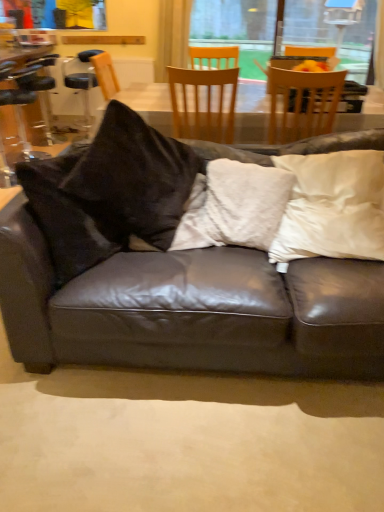
This screenshot has height=512, width=384. What do you see at coordinates (20, 115) in the screenshot?
I see `black leather bar stool at left, which is the 1th chair in left-to-right order` at bounding box center [20, 115].

What do you see at coordinates (234, 206) in the screenshot?
I see `white fuzzy pillow at center, which is the first pillow in left-to-right order` at bounding box center [234, 206].

Where is `matte black leather couch at center`? The width and height of the screenshot is (384, 512). matte black leather couch at center is located at coordinates (187, 307).

Based on the photo, what is the approximate width of white satin pillow at upper right, the 1th pillow in the right-to-left sequence?

The width of white satin pillow at upper right, the 1th pillow in the right-to-left sequence, is 15.48 inches.

This screenshot has width=384, height=512. Describe the element at coordinates (332, 207) in the screenshot. I see `white satin pillow at upper right, the 1th pillow in the right-to-left sequence` at that location.

What is the approximate height of clear plastic bar stool at left?

The height of clear plastic bar stool at left is 34.01 inches.

Consider the image. In order to face clear plastic bar stool at left, should I rotate leftwards or rightwards?

A 19.715 degree turn to the left will do.

You are a GUI agent. You are given a task and a screenshot of the screen. Output one action in this format:
    pyautogui.click(x=<x>, y=<y>)
    Task: Click on the wooden chair at center, which is the 2th chair from left to right
    The width and height of the screenshot is (384, 512).
    Given the screenshot: What is the action you would take?
    pyautogui.click(x=207, y=95)

Which object is closer to the camera taking this photo, black leather bar stool at left, which is the 1th chair in left-to-right order, or clear plastic bar stool at left?

black leather bar stool at left, which is the 1th chair in left-to-right order, is more forward.

Would you say black leather bar stool at left, which is the third chair in right-to-left order, is outside clear plastic bar stool at left?

Yes, black leather bar stool at left, which is the third chair in right-to-left order, is outside of clear plastic bar stool at left.

Which object is wider, black leather bar stool at left, which is the 1th chair in left-to-right order, or clear plastic bar stool at left?

black leather bar stool at left, which is the 1th chair in left-to-right order.

Is black leather bar stool at left, which is the 1th chair in left-to-right order, oriented towards clear plastic bar stool at left?

No, black leather bar stool at left, which is the 1th chair in left-to-right order, is not facing towards clear plastic bar stool at left.

Can you confirm if white satin pillow at upper right, the 2th pillow positioned from the left, is positioned to the right of black leather bar stool at left, which is the third chair in right-to-left order?

Indeed, white satin pillow at upper right, the 2th pillow positioned from the left, is positioned on the right side of black leather bar stool at left, which is the third chair in right-to-left order.

Which point is more distant from viewer, (362,180) or (17,91)?

The point (17,91) is more distant.

This screenshot has height=512, width=384. Identify the location of chair below the white satin pillow at upper right, the 1th pillow in the right-to-left sequence (from a real-world perspective). (20, 115).

Can you tell me how much white satin pillow at upper right, the 1th pillow in the right-to-left sequence, and black leather bar stool at left, which is the third chair in right-to-left order, differ in facing direction?

white satin pillow at upper right, the 1th pillow in the right-to-left sequence, and black leather bar stool at left, which is the third chair in right-to-left order, are facing 89.2 degrees away from each other.

Is white fuzzy pillow at center, which appears as the second pillow when viewed from the right, closer to the viewer compared to black leather bar stool at left, which is the 1th chair in left-to-right order?

Yes, it is.

Can you confirm if white fuzzy pillow at center, which appears as the second pillow when viewed from the right, is shorter than black leather bar stool at left, which is the third chair in right-to-left order?

Yes.

Is white fuzzy pillow at center, which is the first pillow in left-to-right order, not close to black leather bar stool at left, which is the third chair in right-to-left order?

white fuzzy pillow at center, which is the first pillow in left-to-right order, is far away from black leather bar stool at left, which is the third chair in right-to-left order.

From the black leather bar stool at left, which is the third chair in right-to-left order, count 1st pillow to the right and point to it. Please provide its 2D coordinates.

[(234, 206)]

In terms of size, does white satin pillow at upper right, the 2th pillow positioned from the left, appear bigger or smaller than white fuzzy pillow at center, which is the first pillow in left-to-right order?

A: Considering their sizes, white satin pillow at upper right, the 2th pillow positioned from the left, takes up more space than white fuzzy pillow at center, which is the first pillow in left-to-right order.

Who is taller, white satin pillow at upper right, the 2th pillow positioned from the left, or white fuzzy pillow at center, which appears as the second pillow when viewed from the right?

white satin pillow at upper right, the 2th pillow positioned from the left.

From the picture: Choose the correct answer: Is white satin pillow at upper right, the 1th pillow in the right-to-left sequence, inside white fuzzy pillow at center, which is the first pillow in left-to-right order, or outside it?

white satin pillow at upper right, the 1th pillow in the right-to-left sequence, exists outside the volume of white fuzzy pillow at center, which is the first pillow in left-to-right order.

Is white satin pillow at upper right, the 1th pillow in the right-to-left sequence, positioned with its back to white fuzzy pillow at center, which appears as the second pillow when viewed from the right?

No, white satin pillow at upper right, the 1th pillow in the right-to-left sequence, is not facing the opposite direction of white fuzzy pillow at center, which appears as the second pillow when viewed from the right.

Between matte black leather couch at center and clear plastic bar stool at left, which one is positioned behind?

clear plastic bar stool at left.

Does matte black leather couch at center have a smaller size compared to clear plastic bar stool at left?

Actually, matte black leather couch at center might be larger than clear plastic bar stool at left.

Considering the points (25, 356) and (48, 61), which point is behind, point (25, 356) or point (48, 61)?

The point (48, 61) is more distant.

Is matte black leather couch at center oriented towards clear plastic bar stool at left?

No, matte black leather couch at center is not aimed at clear plastic bar stool at left.

How many degrees apart are the facing directions of wooden chair at center, which is the 2th chair from left to right, and clear plastic bar stool at left?

88.8 degrees.

Can you confirm if wooden chair at center, which is the 2th chair from left to right, is taller than clear plastic bar stool at left?

Incorrect, the height of wooden chair at center, which is the 2th chair from left to right, is not larger of that of clear plastic bar stool at left.

From the picture: Do you think wooden chair at center, which is the 2th chair from left to right, is within clear plastic bar stool at left, or outside of it?

The correct answer is: outside.

Which point is more distant from viewer, (198, 262) or (231, 180)?

→ The point (231, 180) is behind.

Which object is wider, matte black leather couch at center or white fuzzy pillow at center, which appears as the second pillow when viewed from the right?

Wider between the two is matte black leather couch at center.

Image resolution: width=384 pixels, height=512 pixels. I want to click on pillow that is the 1st object above the matte black leather couch at center (from a real-world perspective), so [x=234, y=206].

Is matte black leather couch at center completely or partially outside of white fuzzy pillow at center, which appears as the second pillow when viewed from the right?

Indeed, matte black leather couch at center is completely outside white fuzzy pillow at center, which appears as the second pillow when viewed from the right.

This screenshot has width=384, height=512. What are the coordinates of `bar stool on the right of black leather bar stool at left, which is the 1th chair in left-to-right order` in the screenshot? It's located at (40, 90).

You are a GUI agent. You are given a task and a screenshot of the screen. Output one action in this format:
    pyautogui.click(x=<x>, y=<y>)
    Task: Click on the 2nd pillow in front of the black leather bar stool at left, which is the third chair in right-to-left order, counting from the anchor's position
    The image size is (384, 512).
    Given the screenshot: What is the action you would take?
    pyautogui.click(x=332, y=207)

From the image, which object appears to be farther from black leather bar stool at left, which is the 1th chair in left-to-right order, matte black leather couch at center or white satin pillow at upper right, the 1th pillow in the right-to-left sequence?

The object further to black leather bar stool at left, which is the 1th chair in left-to-right order, is white satin pillow at upper right, the 1th pillow in the right-to-left sequence.

Considering their positions, is white satin pillow at upper right, the 1th pillow in the right-to-left sequence, positioned further to white fuzzy pillow at center, which appears as the second pillow when viewed from the right, than clear plastic bar stool at left?

clear plastic bar stool at left.

Looking at the image, which one is located further to black leather bar stool at left, which is the third chair in right-to-left order, white satin pillow at upper right, the 1th pillow in the right-to-left sequence, or wooden chair at center, the second chair positioned from the right?

white satin pillow at upper right, the 1th pillow in the right-to-left sequence, is positioned further to the anchor black leather bar stool at left, which is the third chair in right-to-left order.

From the image, which object appears to be nearer to wooden chair at center, the second chair positioned from the right, matte black leather couch at center or white satin pillow at upper right, the 1th pillow in the right-to-left sequence?

The object closer to wooden chair at center, the second chair positioned from the right, is white satin pillow at upper right, the 1th pillow in the right-to-left sequence.

From the picture: Which object lies further to the anchor point wooden chair at upper center, the 3th chair positioned from the left, wooden chair at center, the second chair positioned from the right, or white fuzzy pillow at center, which is the first pillow in left-to-right order?

white fuzzy pillow at center, which is the first pillow in left-to-right order.

Considering their positions, is white satin pillow at upper right, the 1th pillow in the right-to-left sequence, positioned closer to white fuzzy pillow at center, which is the first pillow in left-to-right order, than black leather bar stool at left, which is the third chair in right-to-left order?

white satin pillow at upper right, the 1th pillow in the right-to-left sequence.

Considering their positions, is wooden chair at center, the second chair positioned from the right, positioned further to matte black leather couch at center than black leather bar stool at left, which is the 1th chair in left-to-right order?

black leather bar stool at left, which is the 1th chair in left-to-right order.

Based on their spatial positions, is clear plastic bar stool at left or wooden chair at center, which is the 2th chair from left to right, closer to matte black leather couch at center?

wooden chair at center, which is the 2th chair from left to right.

Where is `pillow positioned between white satin pillow at upper right, the 1th pillow in the right-to-left sequence, and wooden chair at upper center, the 3th chair positioned from the left, from near to far`? This screenshot has height=512, width=384. pillow positioned between white satin pillow at upper right, the 1th pillow in the right-to-left sequence, and wooden chair at upper center, the 3th chair positioned from the left, from near to far is located at coordinates (234, 206).

Locate an element on the screen. The width and height of the screenshot is (384, 512). pillow between matte black leather couch at center and white fuzzy pillow at center, which is the first pillow in left-to-right order, from front to back is located at coordinates click(332, 207).

Find the location of a particular element. chair between black leather bar stool at left, which is the 1th chair in left-to-right order, and white fuzzy pillow at center, which is the first pillow in left-to-right order, from left to right is located at coordinates (207, 95).

Where is `pillow positioned between white satin pillow at upper right, the 2th pillow positioned from the left, and wooden chair at center, which is the 2th chair from left to right, from near to far`? The image size is (384, 512). pillow positioned between white satin pillow at upper right, the 2th pillow positioned from the left, and wooden chair at center, which is the 2th chair from left to right, from near to far is located at coordinates (234, 206).